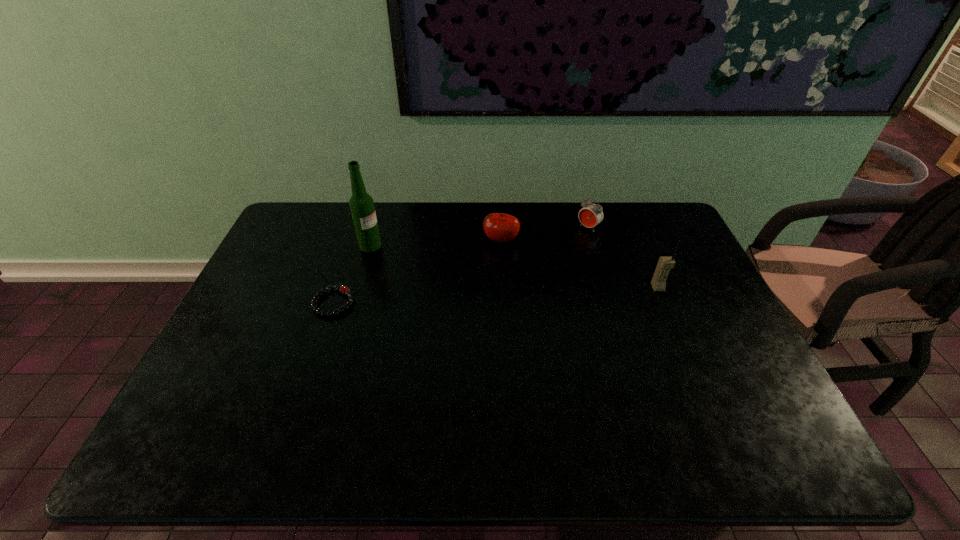
You are a GUI agent. You are given a task and a screenshot of the screen. Output one action in this format:
    pyautogui.click(x=<x>, y=<y>)
    Task: Click on the object that is at the right edge
    This screenshot has width=960, height=540.
    Given the screenshot: What is the action you would take?
    [658, 282]

Find the location of a particular element. free spot at the far edge of the desktop is located at coordinates (420, 223).

In the image, there is a desktop. Identify the location of vacant space at the near edge. This screenshot has width=960, height=540. (507, 399).

Where is `free space at the left edge of the desktop`? free space at the left edge of the desktop is located at coordinates (256, 291).

Where is `blank space at the far left corner of the desktop`? This screenshot has width=960, height=540. blank space at the far left corner of the desktop is located at coordinates (300, 236).

In the image, there is a desktop. At what (x,y) coordinates should I click in order to perform the action: click on vacant space at the far right corner. Please return your answer as a coordinate pair (x, y). Looking at the image, I should click on (672, 233).

I want to click on vacant space at the near right corner of the desktop, so click(708, 390).

Locate an element on the screen. unoccupied position between the cellular telephone and the apple is located at coordinates (579, 264).

Image resolution: width=960 pixels, height=540 pixels. In order to click on blank region between the tallest object and the apple in this screenshot , I will do `click(436, 243)`.

I want to click on vacant space that is in between the beer bottle and the alarm clock, so click(x=479, y=237).